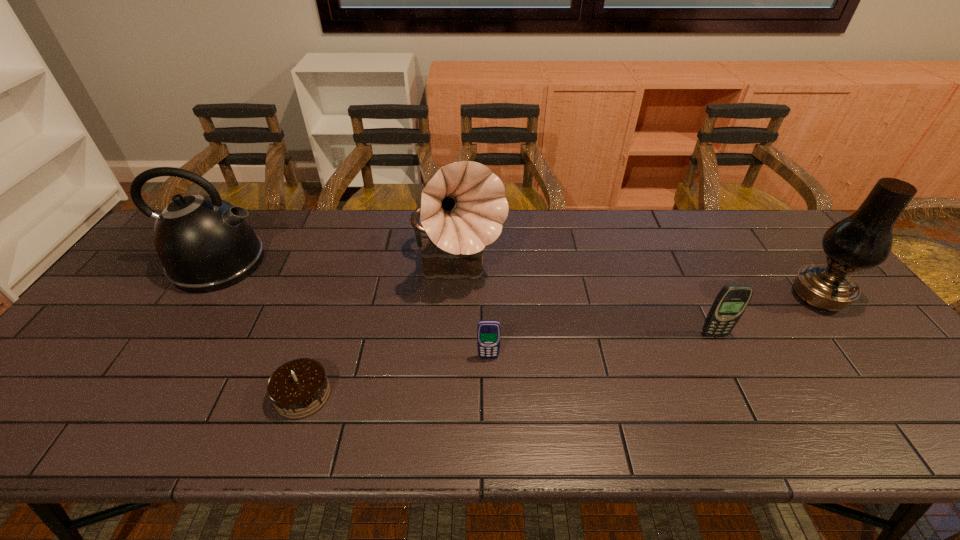
At what (x,y) coordinates should I click in order to perform the action: click on free spot that satisfies the following two spatial constraints: 1. on the spout of the kettle; 2. on the left side of the nearest object. Please return your answer as a coordinate pair (x, y). Looking at the image, I should click on [131, 395].

This screenshot has width=960, height=540. I want to click on free space that satisfies the following two spatial constraints: 1. on the spout of the chocolate cake; 2. on the left side of the leftmost object, so click(x=131, y=395).